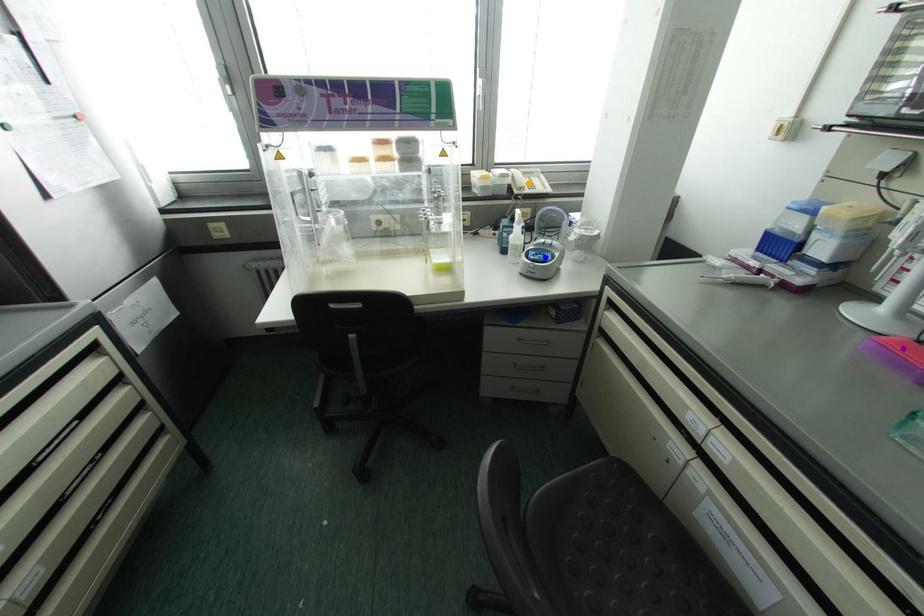
Order these from farthest to nearest:
A) purple point
B) blue point
C) orange point

orange point → blue point → purple point